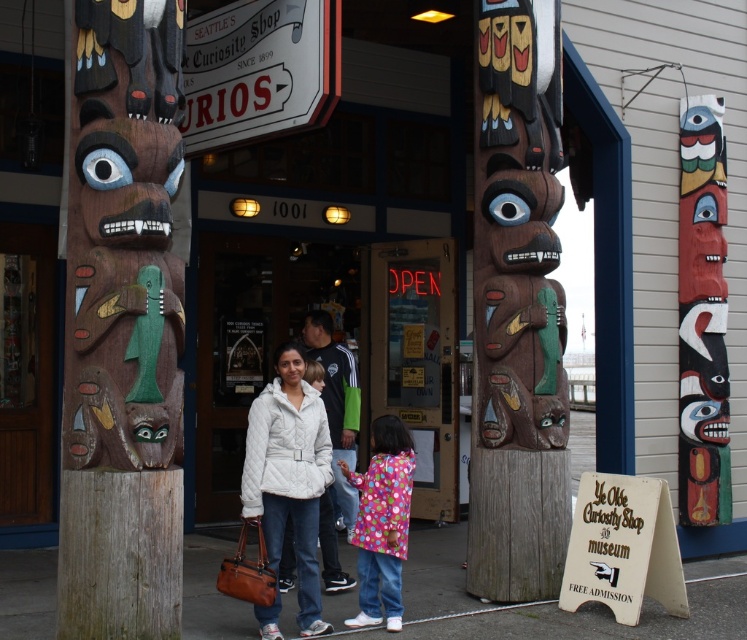
From the picture: Does white quilted jacket at center appear under polka dot coat at center?

Actually, white quilted jacket at center is above polka dot coat at center.

Is point (316, 460) farther from viewer compared to point (396, 547)?

No.

Is point (300, 545) farther from camera compared to point (376, 513)?

No.

This screenshot has width=747, height=640. I want to click on white quilted jacket at center, so click(288, 481).

The image size is (747, 640). What do you see at coordinates (517, 308) in the screenshot? I see `wooden totem pole at center` at bounding box center [517, 308].

Measure the distance between point (495, 250) and camera.

Point (495, 250) and camera are 6.98 meters apart.

The width and height of the screenshot is (747, 640). I want to click on wooden totem pole at center, so click(517, 308).

Can you confirm if wooden totem pole at center is bigger than polka dot coat at center?

Indeed, wooden totem pole at center has a larger size compared to polka dot coat at center.

Can you confirm if wooden totem pole at center is thinner than polka dot coat at center?

No, wooden totem pole at center is not thinner than polka dot coat at center.

What do you see at coordinates (517, 308) in the screenshot? The width and height of the screenshot is (747, 640). I see `wooden totem pole at center` at bounding box center [517, 308].

Locate an element on the screen. This screenshot has height=640, width=747. wooden totem pole at center is located at coordinates (517, 308).